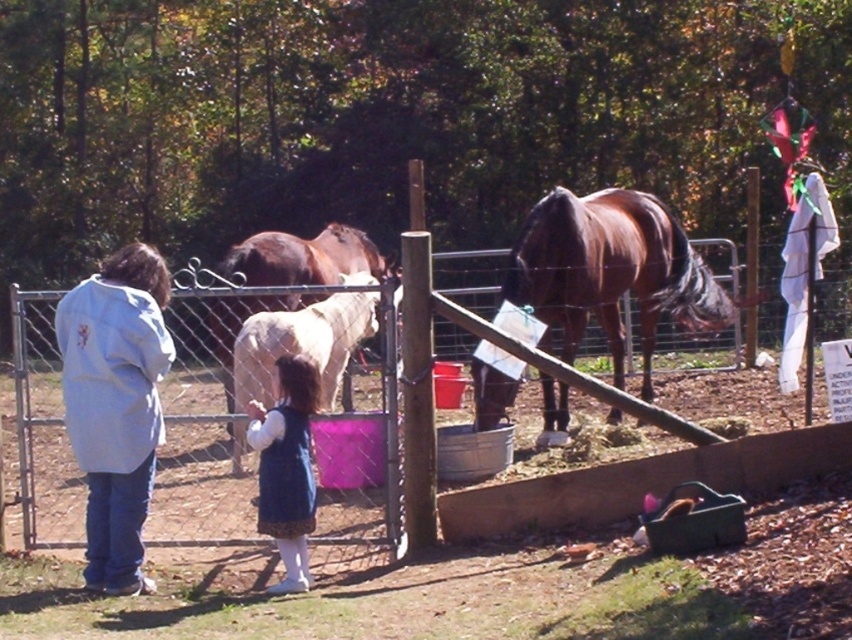
Does point (294, 467) come farther from viewer compared to point (320, 243)?

No.

Is blue velvet dress at center bigger than white glossy horse at center?

Indeed, blue velvet dress at center has a larger size compared to white glossy horse at center.

The width and height of the screenshot is (852, 640). I want to click on blue velvet dress at center, so click(x=286, y=467).

Can you confirm if metal wire fence at center is positioned above blue velvet dress at center?

Yes.

Who is shorter, metal wire fence at center or blue velvet dress at center?

blue velvet dress at center is shorter.

Describe the element at coordinates (197, 436) in the screenshot. This screenshot has height=640, width=852. I see `metal wire fence at center` at that location.

At what (x,y) coordinates should I click in order to perform the action: click on metal wire fence at center. Please return your answer as a coordinate pair (x, y). This screenshot has height=640, width=852. Looking at the image, I should click on (197, 436).

Does white cotton jacket at left come behind white glossy horse at center?

No, white cotton jacket at left is in front of white glossy horse at center.

I want to click on white cotton jacket at left, so click(x=114, y=404).

Is point (67, 307) behind point (288, 300)?

No, it is not.

Find the location of a particular element. The width and height of the screenshot is (852, 640). white cotton jacket at left is located at coordinates (114, 404).